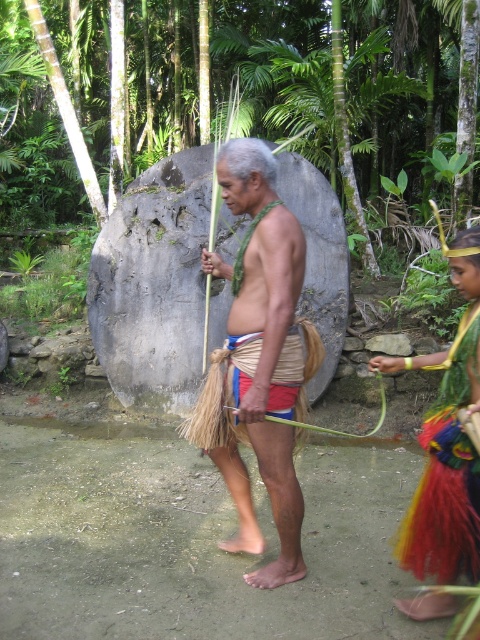
Who is shorter, bare skin at center or multicolored woven skirt at right?

Standing shorter between the two is multicolored woven skirt at right.

Which is more to the right, bare skin at center or multicolored woven skirt at right?

From the viewer's perspective, multicolored woven skirt at right appears more on the right side.

This screenshot has height=640, width=480. Identify the location of bare skin at center. (264, 355).

What are the coordinates of `bare skin at center` in the screenshot? It's located at point(264,355).

Which is behind, point (14, 140) or point (429, 608)?

The point (14, 140) is more distant.

Is green leafy jungle at upper center shorter than multicolored woven skirt at right?

Incorrect, green leafy jungle at upper center's height does not fall short of multicolored woven skirt at right's.

Who is more distant from viewer, [180,147] or [456,248]?

The point [180,147] is behind.

The height and width of the screenshot is (640, 480). Identify the location of green leafy jungle at upper center. (279, 92).

Is green leafy jungle at upper center above bare skin at center?

Yes, green leafy jungle at upper center is above bare skin at center.

Looking at this image, is green leafy jungle at upper center thinner than bare skin at center?

Incorrect, green leafy jungle at upper center's width is not less than bare skin at center's.

Which is in front, point (196, 54) or point (252, 179)?

Point (252, 179) is in front.

Where is `green leafy jungle at upper center`? The width and height of the screenshot is (480, 640). green leafy jungle at upper center is located at coordinates (279, 92).